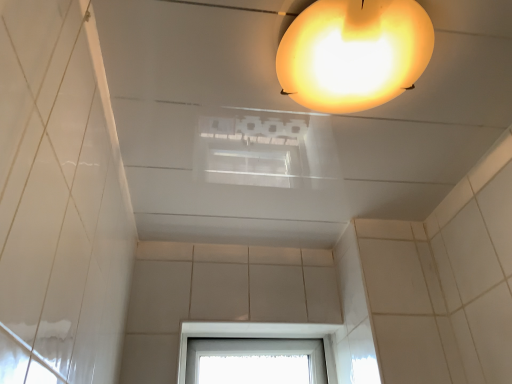
This screenshot has width=512, height=384. What do you see at coordinates (258, 337) in the screenshot?
I see `transparent glass window at lower center` at bounding box center [258, 337].

Measure the distance between point (273, 336) and camera.

Point (273, 336) is 5.10 feet from camera.

Identify the location of transparent glass window at lower center. The image size is (512, 384). (258, 337).

Locate an element on the screen. translucent yellow lampshade at upper center is located at coordinates (354, 53).

The width and height of the screenshot is (512, 384). What do you see at coordinates (354, 53) in the screenshot?
I see `translucent yellow lampshade at upper center` at bounding box center [354, 53].

Locate an element on the screen. The image size is (512, 384). transparent glass window at lower center is located at coordinates (258, 337).

Considering the positions of objects transparent glass window at lower center and translucent yellow lampshade at upper center in the image provided, who is more to the right, transparent glass window at lower center or translucent yellow lampshade at upper center?

From the viewer's perspective, translucent yellow lampshade at upper center appears more on the right side.

Does transparent glass window at lower center come in front of translucent yellow lampshade at upper center?

No, it is behind translucent yellow lampshade at upper center.

Is point (327, 341) positioned behind point (306, 77)?

Yes, point (327, 341) is farther from viewer.

From the image's perspective, does transparent glass window at lower center appear lower than translucent yellow lampshade at upper center?

Yes.

From a real-world perspective, who is located lower, transparent glass window at lower center or translucent yellow lampshade at upper center?

transparent glass window at lower center is physically lower.

Between transparent glass window at lower center and translucent yellow lampshade at upper center, which one has smaller width?

With smaller width is transparent glass window at lower center.

Is transparent glass window at lower center taller or shorter than translucent yellow lampshade at upper center?

In the image, transparent glass window at lower center appears to be taller than translucent yellow lampshade at upper center.

Which of these two, transparent glass window at lower center or translucent yellow lampshade at upper center, is bigger?

transparent glass window at lower center is bigger.

Do you think transparent glass window at lower center is within translucent yellow lampshade at upper center, or outside of it?

transparent glass window at lower center is not enclosed by translucent yellow lampshade at upper center.

Looking at this image, does transparent glass window at lower center touch translucent yellow lampshade at upper center?

No, transparent glass window at lower center is not with translucent yellow lampshade at upper center.

Is transparent glass window at lower center aimed at translucent yellow lampshade at upper center?

No.

How different are the orientations of transparent glass window at lower center and translucent yellow lampshade at upper center in degrees?

They differ by 91.9 degrees in their facing directions.

Measure the distance from transparent glass window at lower center to translucent yellow lampshade at upper center.

transparent glass window at lower center and translucent yellow lampshade at upper center are 37.81 inches apart.

The height and width of the screenshot is (384, 512). I want to click on window below the translucent yellow lampshade at upper center (from a real-world perspective), so click(x=258, y=337).

In the image, is translucent yellow lampshade at upper center on the left side or the right side of transparent glass window at lower center?

Clearly, translucent yellow lampshade at upper center is on the right of transparent glass window at lower center in the image.

In the image, is translucent yellow lampshade at upper center positioned in front of or behind transparent glass window at lower center?

translucent yellow lampshade at upper center is in front of transparent glass window at lower center.

Between point (301, 30) and point (334, 358), which one is positioned behind?

Positioned behind is point (334, 358).

From the image's perspective, between translucent yellow lampshade at upper center and transparent glass window at lower center, which one is located above?

translucent yellow lampshade at upper center, from the image's perspective.

From a real-world perspective, who is located lower, translucent yellow lampshade at upper center or transparent glass window at lower center?

transparent glass window at lower center.

Considering the relative sizes of translucent yellow lampshade at upper center and transparent glass window at lower center in the image provided, is translucent yellow lampshade at upper center wider than transparent glass window at lower center?

Yes, translucent yellow lampshade at upper center is wider than transparent glass window at lower center.

From the picture: Does translucent yellow lampshade at upper center have a lesser height compared to transparent glass window at lower center?

Indeed, translucent yellow lampshade at upper center has a lesser height compared to transparent glass window at lower center.

Who is smaller, translucent yellow lampshade at upper center or transparent glass window at lower center?

translucent yellow lampshade at upper center is smaller.

Do you think translucent yellow lampshade at upper center is within transparent glass window at lower center, or outside of it?

The correct answer is: outside.

Is translucent yellow lampshade at upper center not close to transparent glass window at lower center?

translucent yellow lampshade at upper center is near transparent glass window at lower center, not far away.

Is translucent yellow lampshade at upper center oriented away from transparent glass window at lower center?

No.

How different are the orientations of translucent yellow lampshade at upper center and transparent glass window at lower center in degrees?

They differ by 91.9 degrees in their facing directions.

Identify the location of lamp in front of the transparent glass window at lower center. (354, 53).

Where is `lamp lying above the transparent glass window at lower center (from the image's perspective)`? The width and height of the screenshot is (512, 384). lamp lying above the transparent glass window at lower center (from the image's perspective) is located at coordinates (354, 53).

The height and width of the screenshot is (384, 512). What are the coordinates of `window below the translucent yellow lampshade at upper center (from the image's perspective)` in the screenshot? It's located at (258, 337).